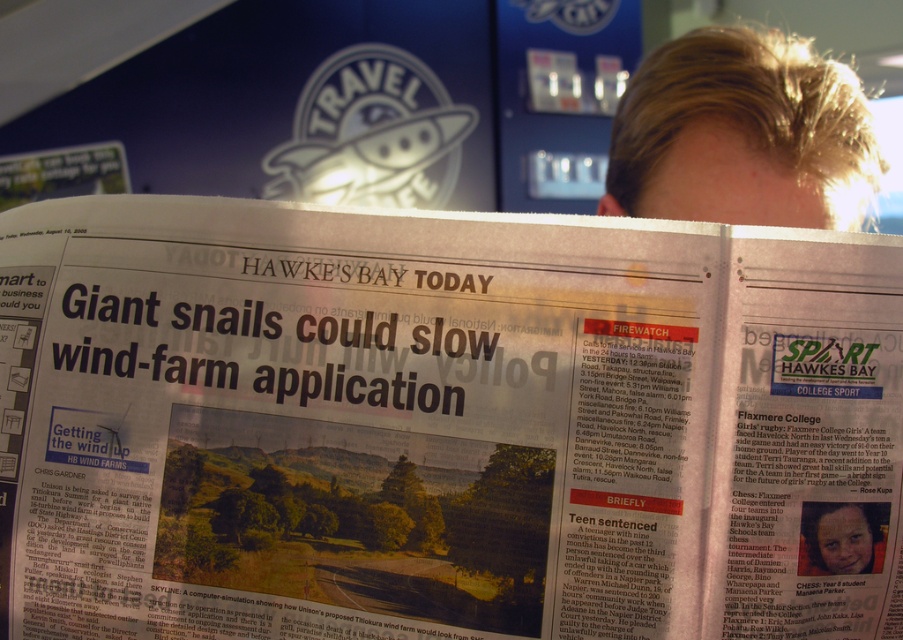
Who is taller, white glossy newspaper at center or blonde hair at upper right?

With more height is blonde hair at upper right.

I want to click on white glossy newspaper at center, so click(443, 424).